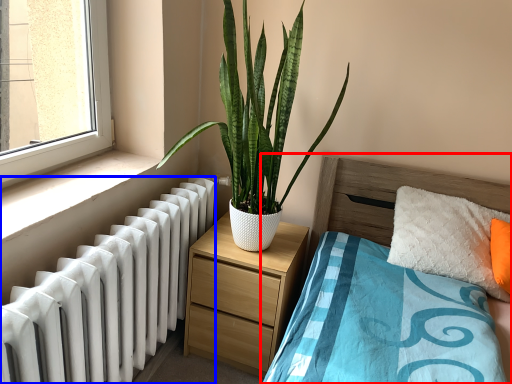
Question: Which object is closer to the camera taking this photo, bed (highlighted by a red box) or radiator (highlighted by a blue box)?

Choices:
 (A) bed
 (B) radiator

Answer: (A)